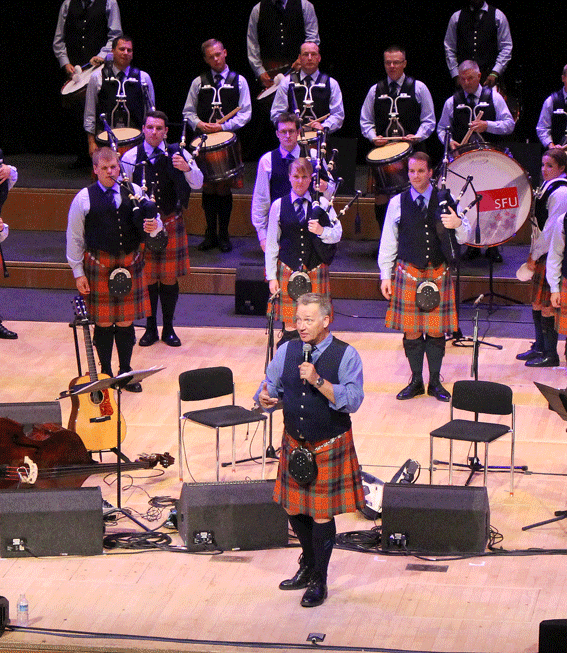
What are the coordinates of `bottle of water` in the screenshot? It's located at (25, 611).